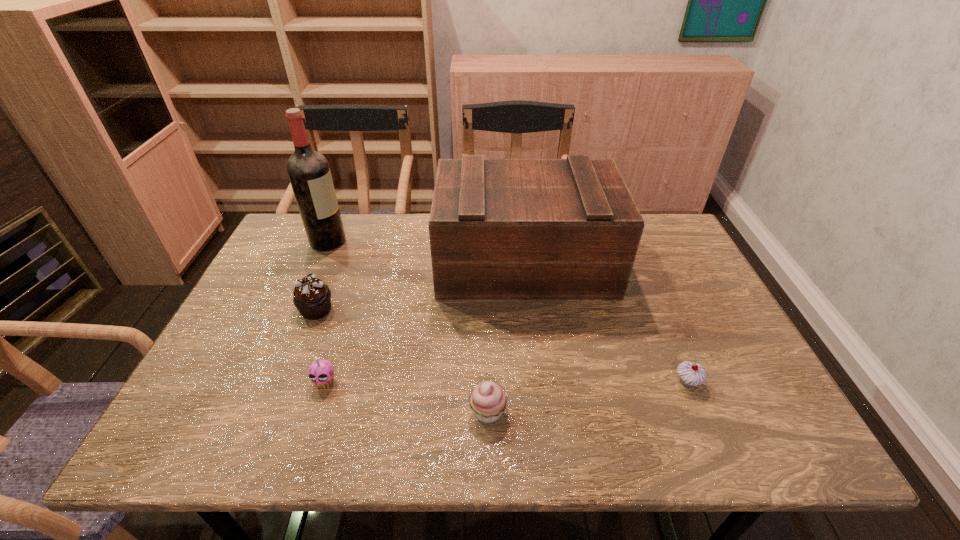
Where is `blank space that satisfies the following two spatial constraints: 1. on the front-facing side of the tallest object; 2. on the left side of the farthest cupcake`? blank space that satisfies the following two spatial constraints: 1. on the front-facing side of the tallest object; 2. on the left side of the farthest cupcake is located at coordinates (299, 309).

Image resolution: width=960 pixels, height=540 pixels. In order to click on vacant space that satisfies the following two spatial constraints: 1. on the front-facing side of the tallest object; 2. on the right side of the second cupcake from right to left in this screenshot , I will do `click(254, 412)`.